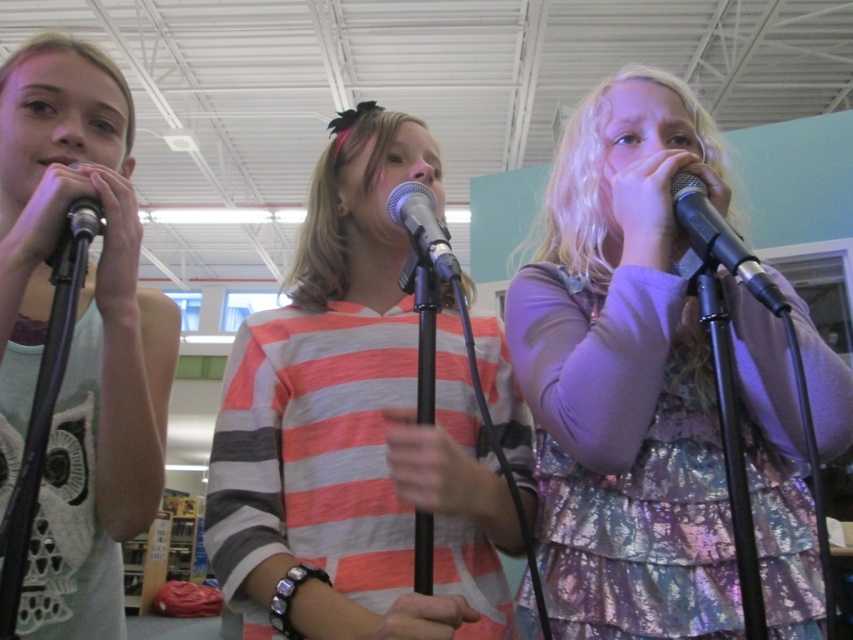
You are a sound technician setting up for a school play. You need to ensure that the microphones are spaced at least 12 inches apart to avoid feedback. Are the metallic silver microphone at center and metallic silver microphone at left positioned correctly?

The metallic silver microphone at center and metallic silver microphone at left are spaced 12.70 inches apart, which meets the minimum requirement of 12 inches. Therefore, they are positioned correctly to avoid feedback.

From the picture: You are a photographer setting up for a group photo. You need to ensure that the matte white tank top at left and the metallic silver microphone at right are both visible in the frame. Given that the camera has a fixed focal length, which object should you prioritize keeping centered to avoid cropping either one?

The matte white tank top at left is wider than the metallic silver microphone at right, so prioritizing the matte white tank top at left to stay centered would help ensure both are visible without cropping either object.